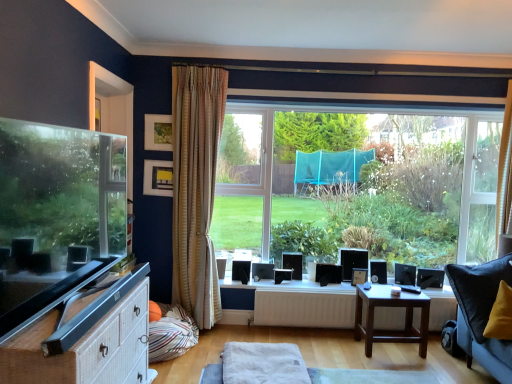
Question: From the image's perspective, would you say white matte radiator at center is positioned over matte yellow picture frame at upper left, marked as the 2th picture frame in a bottom-to-top arrangement?

Choices:
 (A) yes
 (B) no

Answer: (B)

Question: Can you confirm if white matte radiator at center is taller than matte yellow picture frame at upper left, the 2th picture frame in the front-to-back sequence?

Choices:
 (A) no
 (B) yes

Answer: (A)

Question: Is white matte radiator at center at the left side of matte yellow picture frame at upper left, the 2th picture frame in the front-to-back sequence?

Choices:
 (A) no
 (B) yes

Answer: (A)

Question: Is white matte radiator at center facing away from matte yellow picture frame at upper left, positioned as the 2th picture frame in left-to-right order?

Choices:
 (A) no
 (B) yes

Answer: (A)

Question: From a real-world perspective, is white matte radiator at center positioned over matte yellow picture frame at upper left, marked as the 2th picture frame in a bottom-to-top arrangement, based on gravity?

Choices:
 (A) yes
 (B) no

Answer: (B)

Question: Is white matte radiator at center closer to the viewer compared to matte yellow picture frame at upper left, positioned as the 2th picture frame in top-to-bottom order?

Choices:
 (A) yes
 (B) no

Answer: (B)

Question: Does white wicker cabinet at lower left have a smaller size compared to matte yellow picture frame at upper left, positioned as the 2th picture frame in left-to-right order?

Choices:
 (A) no
 (B) yes

Answer: (A)

Question: From the image's perspective, is white wicker cabinet at lower left on top of matte yellow picture frame at upper left, the 2th picture frame in the front-to-back sequence?

Choices:
 (A) no
 (B) yes

Answer: (A)

Question: From the image's perspective, does white wicker cabinet at lower left appear lower than matte yellow picture frame at upper left, which is the second picture frame in right-to-left order?

Choices:
 (A) no
 (B) yes

Answer: (B)

Question: Is white wicker cabinet at lower left thinner than matte yellow picture frame at upper left, positioned as the 2th picture frame in left-to-right order?

Choices:
 (A) yes
 (B) no

Answer: (B)

Question: Is white wicker cabinet at lower left facing towards matte yellow picture frame at upper left, positioned as the 2th picture frame in left-to-right order?

Choices:
 (A) yes
 (B) no

Answer: (B)

Question: Is matte yellow picture frame at upper left, positioned as the 2th picture frame in top-to-bottom order, inside white wicker cabinet at lower left?

Choices:
 (A) no
 (B) yes

Answer: (A)

Question: Is striped fabric pillow at lower left taller than black plastic speaker at lower right?

Choices:
 (A) no
 (B) yes

Answer: (B)